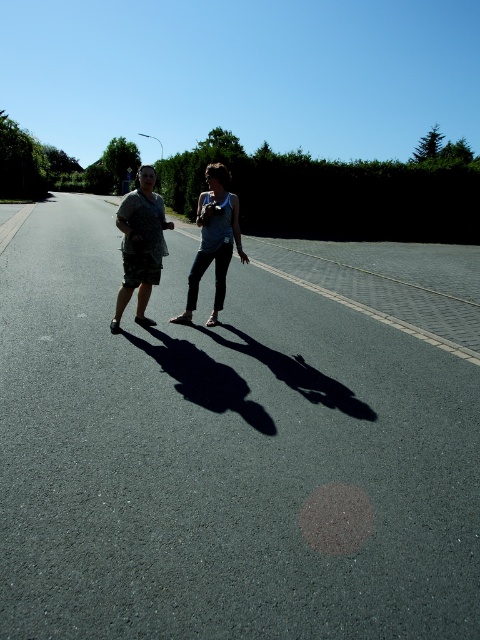
Is camouflage fabric dress at center behind camouflage shorts at center?

That is False.

Can you confirm if camouflage fabric dress at center is wider than camouflage shorts at center?

Yes.

Who is more distant from viewer, (127, 296) or (143, 230)?

The point (127, 296) is behind.

At what (x,y) coordinates should I click in order to perform the action: click on camouflage fabric dress at center. Please return your answer as a coordinate pair (x, y). The width and height of the screenshot is (480, 640). Looking at the image, I should click on (141, 244).